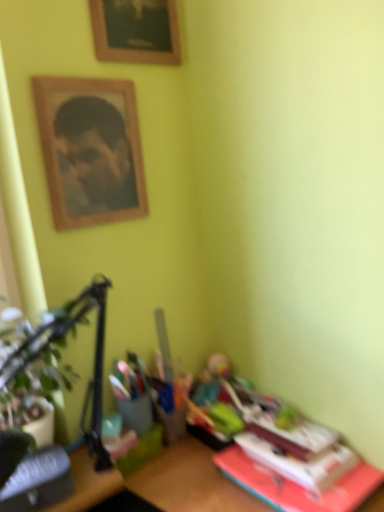
You are a GUI agent. You are given a task and a screenshot of the screen. Output one action in this format:
    pyautogui.click(x=<x>, y=<y>)
    Task: Click on the hardcover book at lower left, positioned as the 2th paperback book in right-to-left order
    This screenshot has height=512, width=384.
    Given the screenshot: What is the action you would take?
    pyautogui.click(x=38, y=481)

Describe the element at coordinates (38, 481) in the screenshot. I see `hardcover book at lower left, which appears as the first paperback book when viewed from the left` at that location.

Find the location of a particular element. This screenshot has width=384, height=512. wooden framed portrait at upper left is located at coordinates (94, 157).

What is the approximate width of wooden framed portrait at upper left?

The width of wooden framed portrait at upper left is 1.50 inches.

The image size is (384, 512). I want to click on hardcover book at lower left, which appears as the first paperback book when viewed from the left, so (x=38, y=481).

Which is in front, green leafy plant at left or hardcover book at lower right, which is counted as the second paperback book, starting from the left?

green leafy plant at left is in front.

Is green leafy plant at left positioned with its back to hardcover book at lower right, which is counted as the second paperback book, starting from the left?

No, green leafy plant at left is not facing the opposite direction of hardcover book at lower right, which is counted as the second paperback book, starting from the left.

Is green leafy plant at left not near hardcover book at lower right, the first paperback book in the right-to-left sequence?

No, there isn't a large distance between green leafy plant at left and hardcover book at lower right, the first paperback book in the right-to-left sequence.

Considering the sizes of objects green leafy plant at left and hardcover book at lower right, which is counted as the second paperback book, starting from the left, in the image provided, who is shorter, green leafy plant at left or hardcover book at lower right, which is counted as the second paperback book, starting from the left,?

With less height is hardcover book at lower right, which is counted as the second paperback book, starting from the left.

Does green leafy plant at left turn towards wooden picture frame at upper center?

No, green leafy plant at left is not turned towards wooden picture frame at upper center.

From the image's perspective, which one is positioned lower, green leafy plant at left or wooden picture frame at upper center?

green leafy plant at left appears lower in the image.

Choose the correct answer: Is green leafy plant at left inside wooden picture frame at upper center or outside it?

green leafy plant at left exists outside the volume of wooden picture frame at upper center.

Considering their positions, is green leafy plant at left located in front of or behind wooden picture frame at upper center?

Visually, green leafy plant at left is located in front of wooden picture frame at upper center.

From the image's perspective, is wooden picture frame at upper center positioned above or below green leafy plant at left?

wooden picture frame at upper center is above green leafy plant at left.

Does wooden picture frame at upper center touch green leafy plant at left?

wooden picture frame at upper center and green leafy plant at left are not in contact.

Can you confirm if wooden picture frame at upper center is smaller than green leafy plant at left?

Indeed, wooden picture frame at upper center has a smaller size compared to green leafy plant at left.

Is wooden picture frame at upper center closer to camera compared to green leafy plant at left?

No, wooden picture frame at upper center is further to the viewer.

Considering the relative sizes of wooden picture frame at upper center and hardcover book at lower left, which appears as the first paperback book when viewed from the left, in the image provided, is wooden picture frame at upper center taller than hardcover book at lower left, which appears as the first paperback book when viewed from the left,?

Yes, wooden picture frame at upper center is taller than hardcover book at lower left, which appears as the first paperback book when viewed from the left.

From the image's perspective, starting from the wooden picture frame at upper center, which paperback book is the 2nd one below? Please provide its 2D coordinates.

[(38, 481)]

How many degrees apart are the facing directions of wooden picture frame at upper center and hardcover book at lower left, which appears as the first paperback book when viewed from the left?

There is a 10.1-degree angle between the facing directions of wooden picture frame at upper center and hardcover book at lower left, which appears as the first paperback book when viewed from the left.

Between wooden picture frame at upper center and hardcover book at lower left, positioned as the 2th paperback book in right-to-left order, which one has smaller size?

hardcover book at lower left, positioned as the 2th paperback book in right-to-left order, is smaller.

From a real-world perspective, between wooden framed portrait at upper left and hardcover book at lower right, which is counted as the second paperback book, starting from the left, who is vertically lower?

In real-world perspective, hardcover book at lower right, which is counted as the second paperback book, starting from the left, is lower.

What are the coordinates of `man that appears behind the hardcover book at lower right, which is counted as the second paperback book, starting from the left` in the screenshot? It's located at (94, 157).

Which of these two, wooden framed portrait at upper left or hardcover book at lower right, the first paperback book in the right-to-left sequence, is bigger?

wooden framed portrait at upper left.

From a real-world perspective, between hardcover book at lower right, which is counted as the second paperback book, starting from the left, and hardcover book at lower left, which appears as the first paperback book when viewed from the left, who is vertically higher?

hardcover book at lower left, which appears as the first paperback book when viewed from the left, from a real-world perspective.

From the image's perspective, is hardcover book at lower right, the first paperback book in the right-to-left sequence, located above hardcover book at lower left, positioned as the 2th paperback book in right-to-left order?

Correct, hardcover book at lower right, the first paperback book in the right-to-left sequence, appears higher than hardcover book at lower left, positioned as the 2th paperback book in right-to-left order, in the image.

From the picture: Considering the sizes of hardcover book at lower right, which is counted as the second paperback book, starting from the left, and hardcover book at lower left, positioned as the 2th paperback book in right-to-left order, in the image, is hardcover book at lower right, which is counted as the second paperback book, starting from the left, wider or thinner than hardcover book at lower left, positioned as the 2th paperback book in right-to-left order,?

hardcover book at lower right, which is counted as the second paperback book, starting from the left, is wider than hardcover book at lower left, positioned as the 2th paperback book in right-to-left order.

Who is shorter, hardcover book at lower right, the first paperback book in the right-to-left sequence, or hardcover book at lower left, which appears as the first paperback book when viewed from the left?

With less height is hardcover book at lower right, the first paperback book in the right-to-left sequence.

Considering the sizes of objects hardcover book at lower right, which is counted as the second paperback book, starting from the left, and green leafy plant at left in the image provided, who is bigger, hardcover book at lower right, which is counted as the second paperback book, starting from the left, or green leafy plant at left?

green leafy plant at left.

Where is `the 2nd paperback book directly beneath the green leafy plant at left (from a real-world perspective)`? The height and width of the screenshot is (512, 384). the 2nd paperback book directly beneath the green leafy plant at left (from a real-world perspective) is located at coordinates (300, 462).

From a real-world perspective, which is physically above, hardcover book at lower right, which is counted as the second paperback book, starting from the left, or green leafy plant at left?

green leafy plant at left.

Based on the photo, based on their positions, is hardcover book at lower right, which is counted as the second paperback book, starting from the left, located to the left or right of green leafy plant at left?

From the image, it's evident that hardcover book at lower right, which is counted as the second paperback book, starting from the left, is to the right of green leafy plant at left.

At what (x,y) coordinates should I click in order to perform the action: click on plant located above the hardcover book at lower right, the first paperback book in the right-to-left sequence (from the image's perspective). Please return your answer as a coordinate pair (x, y). This screenshot has height=512, width=384. Looking at the image, I should click on (37, 360).

In order to click on plant below the wooden picture frame at upper center (from the image's perspective) in this screenshot , I will do `click(37, 360)`.

In the scene shown: Looking at the image, which one is located closer to hardcover book at lower left, positioned as the 2th paperback book in right-to-left order, green leafy plant at left or hardcover book at lower right, which is counted as the second paperback book, starting from the left?

green leafy plant at left is positioned closer to the anchor hardcover book at lower left, positioned as the 2th paperback book in right-to-left order.

Which object lies nearer to the anchor point wooden framed portrait at upper left, wooden picture frame at upper center or hardcover book at lower right, which is counted as the second paperback book, starting from the left?

wooden picture frame at upper center lies closer to wooden framed portrait at upper left than the other object.

Estimate the real-world distances between objects in this image. Which object is further from hardcover book at lower left, which appears as the first paperback book when viewed from the left, hardcover book at lower right, which is counted as the second paperback book, starting from the left, or green leafy plant at left?

hardcover book at lower right, which is counted as the second paperback book, starting from the left.

When comparing their distances from hardcover book at lower right, the first paperback book in the right-to-left sequence, does wooden framed portrait at upper left or wooden picture frame at upper center seem closer?

wooden framed portrait at upper left.

Looking at the image, which one is located further to hardcover book at lower right, the first paperback book in the right-to-left sequence, hardcover book at lower left, which appears as the first paperback book when viewed from the left, or green leafy plant at left?

Among the two, green leafy plant at left is located further to hardcover book at lower right, the first paperback book in the right-to-left sequence.

Based on their spatial positions, is wooden picture frame at upper center or hardcover book at lower left, which appears as the first paperback book when viewed from the left, closer to hardcover book at lower right, the first paperback book in the right-to-left sequence?

hardcover book at lower left, which appears as the first paperback book when viewed from the left.

From the image, which object appears to be farther from hardcover book at lower left, which appears as the first paperback book when viewed from the left, green leafy plant at left or wooden framed portrait at upper left?

→ wooden framed portrait at upper left is further to hardcover book at lower left, which appears as the first paperback book when viewed from the left.

Which object lies further to the anchor point hardcover book at lower left, positioned as the 2th paperback book in right-to-left order, wooden picture frame at upper center or wooden framed portrait at upper left?

wooden picture frame at upper center is further to hardcover book at lower left, positioned as the 2th paperback book in right-to-left order.

You are a GUI agent. You are given a task and a screenshot of the screen. Output one action in this format:
    pyautogui.click(x=<x>, y=<y>)
    Task: Click on the paperback book that lies between wooden picture frame at upper center and hardcover book at lower left, which appears as the first paperback book when viewed from the left, from top to bottom
    The image size is (384, 512).
    Given the screenshot: What is the action you would take?
    [x=300, y=462]

Where is `plant between wooden framed portrait at upper left and hardcover book at lower left, positioned as the 2th paperback book in right-to-left order, in the up-down direction`? plant between wooden framed portrait at upper left and hardcover book at lower left, positioned as the 2th paperback book in right-to-left order, in the up-down direction is located at coordinates (37, 360).

You are a GUI agent. You are given a task and a screenshot of the screen. Output one action in this format:
    pyautogui.click(x=<x>, y=<y>)
    Task: Click on the plant that lies between wooden picture frame at upper center and hardcover book at lower left, which appears as the first paperback book when viewed from the left, from top to bottom
    This screenshot has height=512, width=384.
    Given the screenshot: What is the action you would take?
    (x=37, y=360)

I want to click on paperback book between green leafy plant at left and hardcover book at lower right, which is counted as the second paperback book, starting from the left, so click(38, 481).